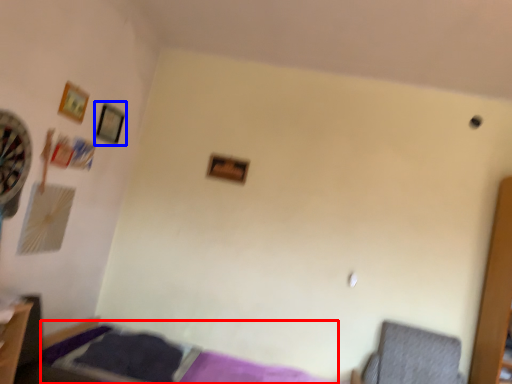
Question: Which object appears closest to the camera in this image, bed (highlighted by a red box) or picture frame (highlighted by a blue box)?

Choices:
 (A) bed
 (B) picture frame

Answer: (A)